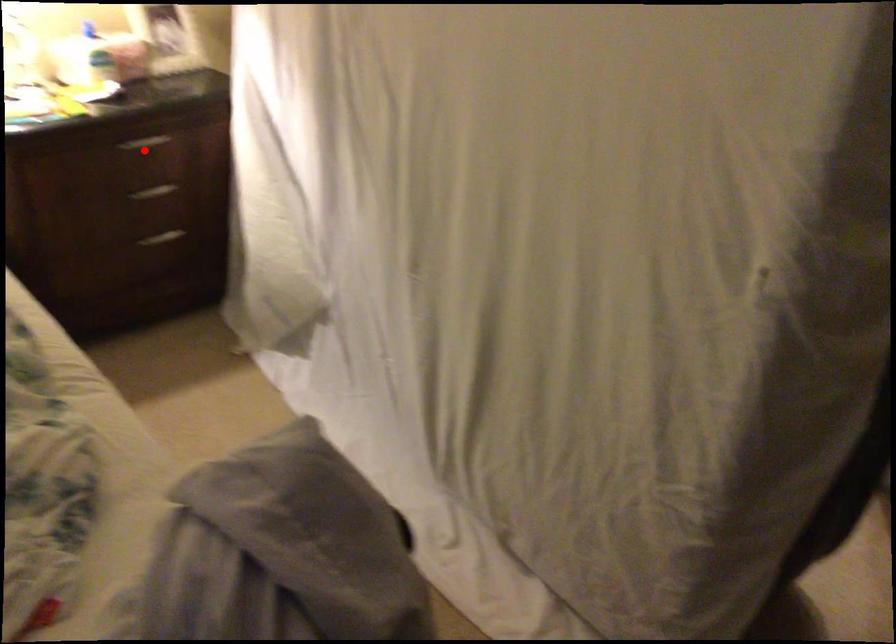
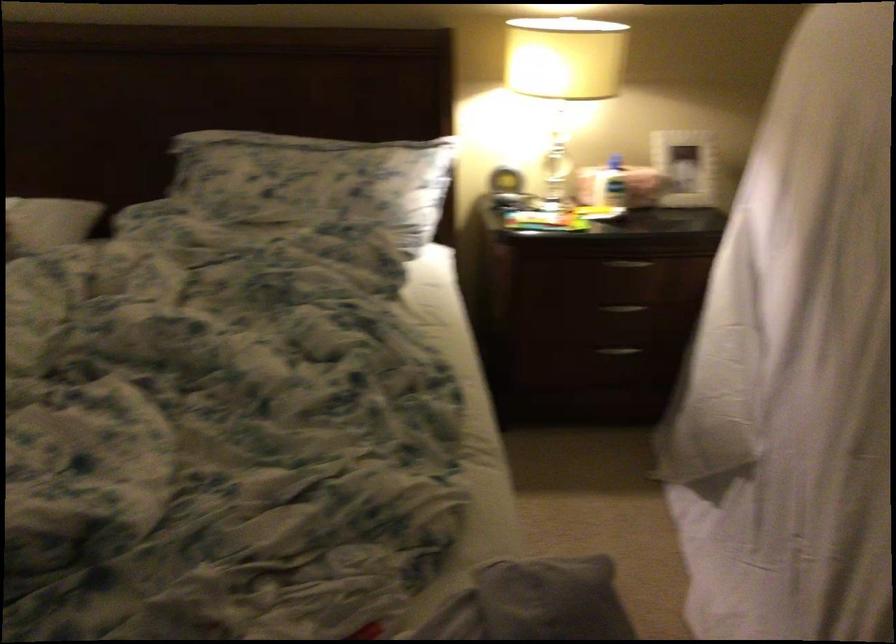
In the second image, find the point that corresponds to the highlighted location in the first image.

(627, 263)